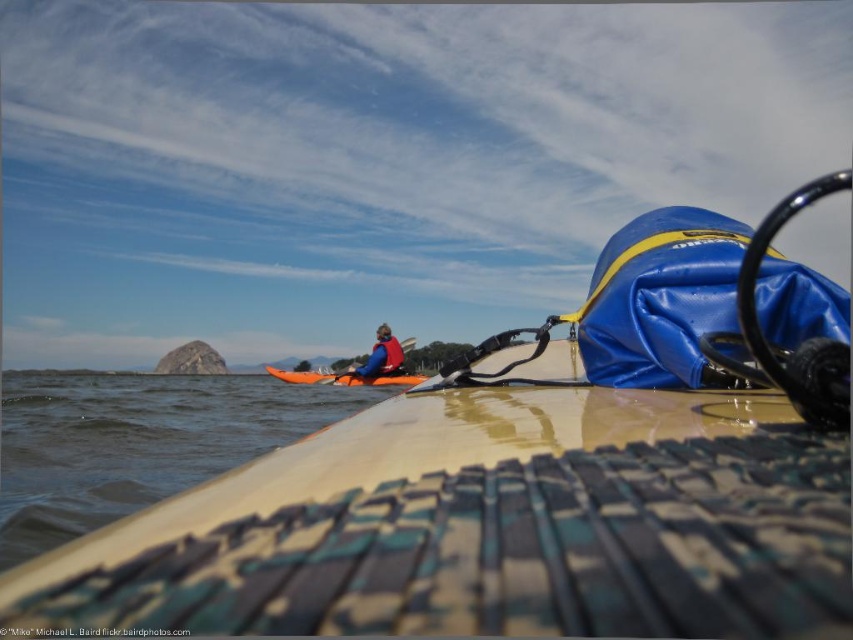
Question: Does matte yellow kayak at center appear on the right side of clear water at lower left?

Choices:
 (A) no
 (B) yes

Answer: (B)

Question: Does clear water at lower left come behind orange plastic paddle at center?

Choices:
 (A) yes
 (B) no

Answer: (B)

Question: Which point is farther to the camera?

Choices:
 (A) orange plastic paddle at center
 (B) matte yellow kayak at center
 (C) red life vest at center
 (D) clear water at lower left

Answer: (A)

Question: Considering the real-world distances, which object is closest to the clear water at lower left?

Choices:
 (A) matte yellow kayak at center
 (B) orange plastic paddle at center
 (C) red life vest at center

Answer: (A)

Question: From the image, what is the correct spatial relationship of matte yellow kayak at center in relation to red life vest at center?

Choices:
 (A) right
 (B) left

Answer: (A)

Question: Which object appears closest to the camera in this image?

Choices:
 (A) orange plastic paddle at center
 (B) red life vest at center

Answer: (B)